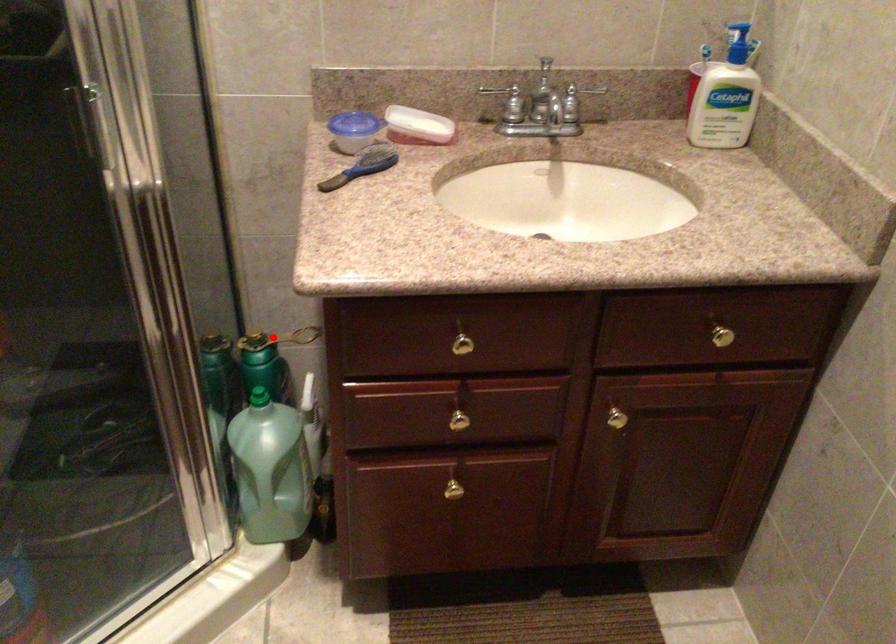
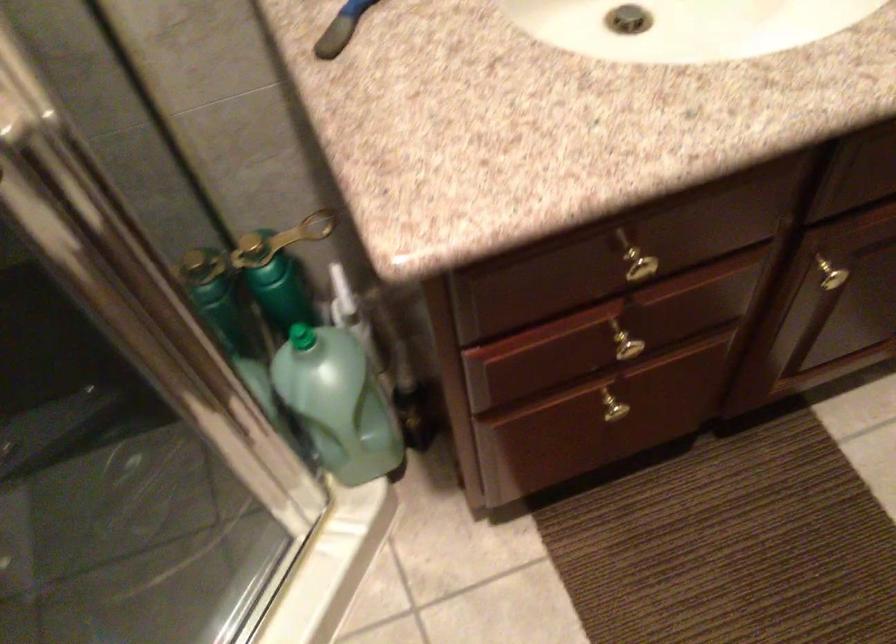
The point at the highlighted location is marked in the first image. Where is the corresponding point in the second image?

(280, 240)